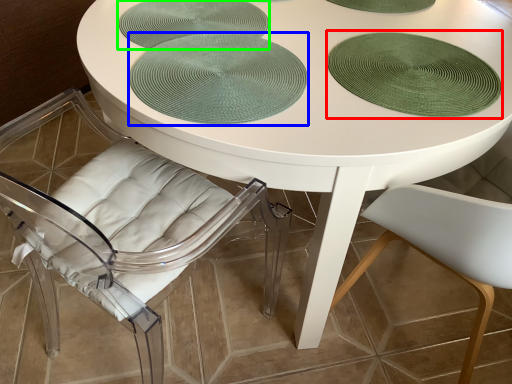
Question: Estimate the real-world distances between objects in this image. Which object is closer to glass plate (highlighted by a red box), poker table (highlighted by a blue box) or glass plate (highlighted by a green box)?

Choices:
 (A) poker table
 (B) glass plate

Answer: (A)